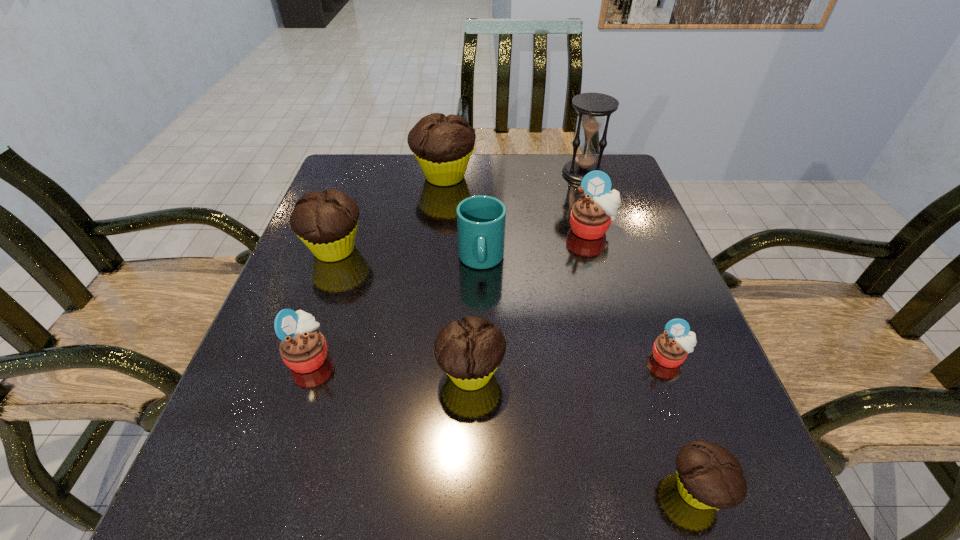
Where is `free point between the second biggest pink muffin and the black hourglass`? This screenshot has height=540, width=960. free point between the second biggest pink muffin and the black hourglass is located at coordinates (446, 265).

The height and width of the screenshot is (540, 960). In order to click on vacant space that's between the third farthest chocolate muffin and the smallest pink muffin in this screenshot , I will do `click(570, 365)`.

Choose which object is the third nearest neighbor to the third farthest chocolate muffin. Please provide its 2D coordinates. Your answer should be formatted as a tuple, i.e. [(x, y)], where the tuple contains the x and y coordinates of a point satisfying the conditions above.

[(708, 476)]

Where is `the fifth closest object relative to the tallest object`? the fifth closest object relative to the tallest object is located at coordinates (670, 349).

Locate an element on the screen. The image size is (960, 540). muffin that stands as the second closest to the farthest pink muffin is located at coordinates (670, 349).

Image resolution: width=960 pixels, height=540 pixels. What are the coordinates of `muffin that is the fifth closest to the smallest chocolate muffin` in the screenshot? It's located at (326, 222).

Select which chocolate muffin appears as the second closest to the third biggest chocolate muffin. Please provide its 2D coordinates. Your answer should be formatted as a tuple, i.e. [(x, y)], where the tuple contains the x and y coordinates of a point satisfying the conditions above.

[(326, 222)]

Locate which chocolate muffin ranks in proximity to the cup. Please provide its 2D coordinates. Your answer should be formatted as a tuple, i.e. [(x, y)], where the tuple contains the x and y coordinates of a point satisfying the conditions above.

[(469, 351)]

This screenshot has width=960, height=540. I want to click on pink muffin that stands as the third closest to the black hourglass, so click(303, 348).

Where is `pink muffin that is the closest to the black hourglass`? This screenshot has height=540, width=960. pink muffin that is the closest to the black hourglass is located at coordinates (591, 216).